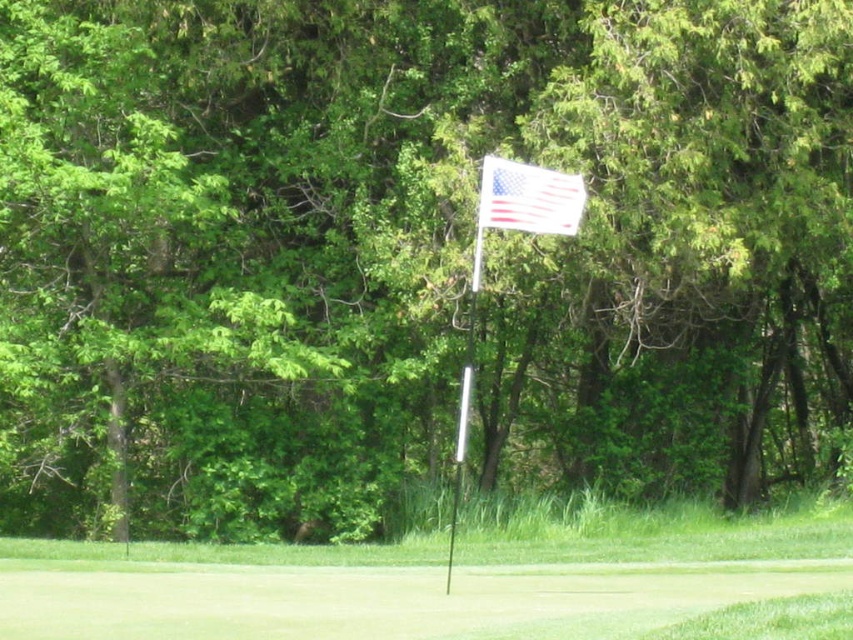
Question: Which point is farther to the camera?

Choices:
 (A) silver metallic flag pole at center
 (B) white fabric flag at upper center

Answer: (A)

Question: Is white plastic flag at center to the left of silver metallic flag pole at center from the viewer's perspective?

Choices:
 (A) no
 (B) yes

Answer: (B)

Question: Based on their relative distances, which object is nearer to the silver metallic flag pole at center?

Choices:
 (A) white fabric flag at upper center
 (B) white plastic flag at center

Answer: (B)

Question: Which point is farther to the camera?

Choices:
 (A) (529, 186)
 (B) (461, 390)

Answer: (B)

Question: From the image, what is the correct spatial relationship of white fabric flag at upper center in relation to silver metallic flag pole at center?

Choices:
 (A) left
 (B) right

Answer: (B)

Question: Does white plastic flag at center appear under silver metallic flag pole at center?

Choices:
 (A) no
 (B) yes

Answer: (B)